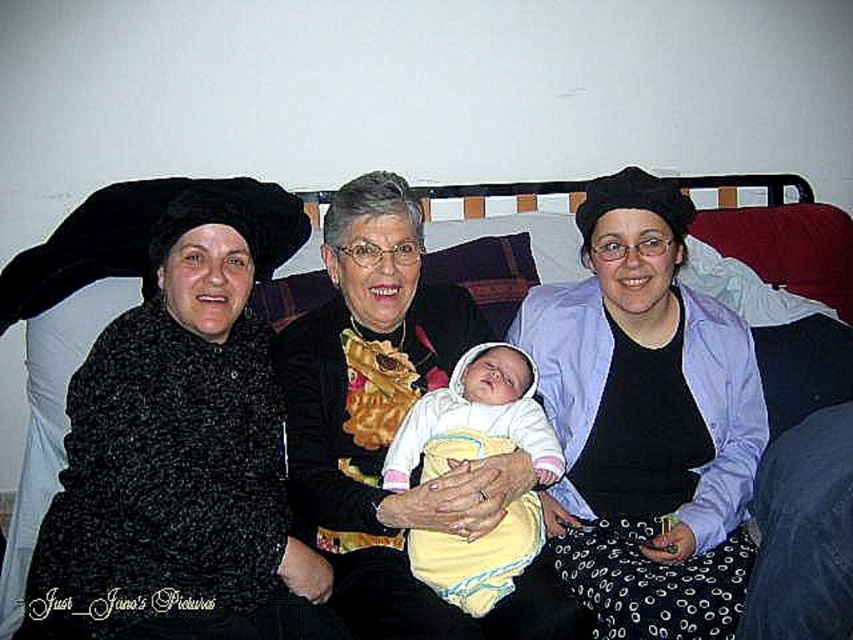
Looking at this image, you are a photographer taking a portrait of the matte black beret at center and the matte black coat at left. You want to ensure both items are clearly visible in the frame. Based on their positions, which item might be partially obscured and why?

The matte black beret at center might be partially obscured because it is positioned under the matte black coat at left, which could block part of the beret from view.

You are a photographer who needs to adjust the lighting for a portrait of the two women in the image. The matte black beret at center and the matte black coat at left are both in the frame. Based on their positions, which object is located to the right of the other?

The matte black beret at center is positioned on the right side of the matte black coat at left.

You are a photographer setting up a shoot in this room. You need to position a light source to the left of the matte black coat at left and to the right of the yellow fleece baby at center. Is this possible given their positions?

The matte black coat at left is to the left of the yellow fleece baby at center, so placing a light source to the left of the matte black coat at left and to the right of the yellow fleece baby at center is not possible because the light would need to be both left of the coat and right of the baby, which are in opposite directions.